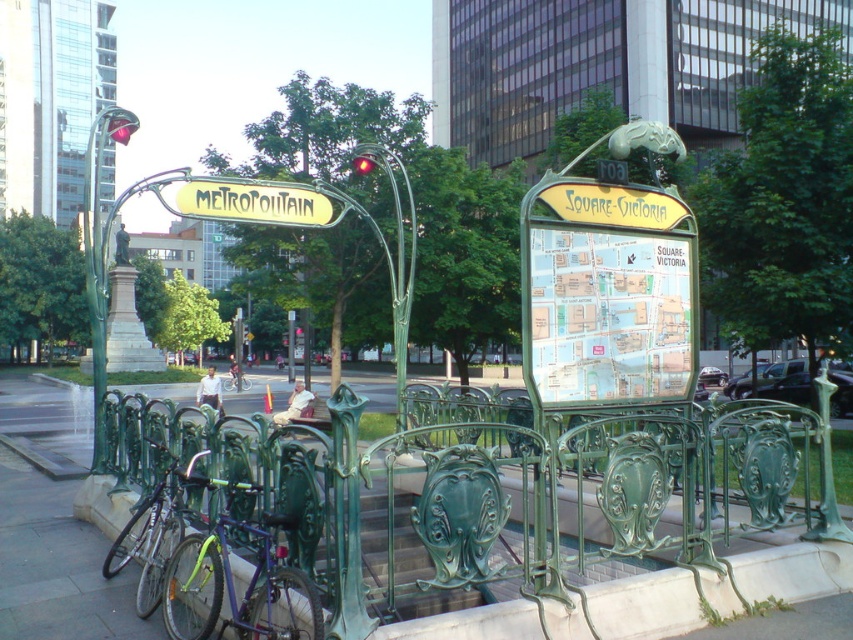
Is point (97, 365) farther from camera compared to point (114, 547)?

That is True.

Is point (103, 252) farther from viewer compared to point (202, 477)?

Yes, it is.

At what (x,y) coordinates should I click in order to perform the action: click on green patinated metal lamp post at left. Please return your answer as a coordinate pair (x, y). This screenshot has height=640, width=853. Looking at the image, I should click on (100, 256).

Based on the photo, does purple matte bicycle at center have a greater height compared to yellow metallic signboard at center?

Yes, purple matte bicycle at center is taller than yellow metallic signboard at center.

You are a GUI agent. You are given a task and a screenshot of the screen. Output one action in this format:
    pyautogui.click(x=<x>, y=<y>)
    Task: Click on the purple matte bicycle at center
    
    Given the screenshot: What is the action you would take?
    pyautogui.click(x=233, y=586)

Consider the image. Which is below, purple matte bicycle at center or green patinated metal lamp post at left?

Positioned lower is purple matte bicycle at center.

Between purple matte bicycle at center and green patinated metal lamp post at left, which one has more height?

green patinated metal lamp post at left is taller.

The image size is (853, 640). Find the location of `purple matte bicycle at center`. purple matte bicycle at center is located at coordinates (233, 586).